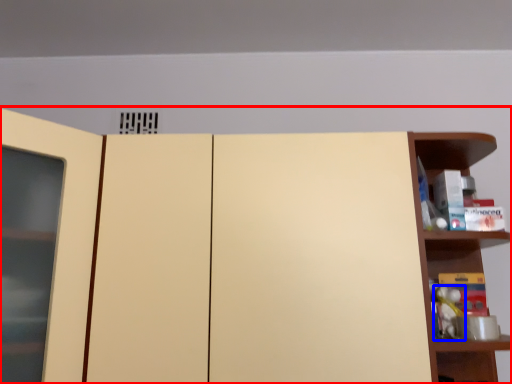
Question: Among these objects, which one is nearest to the camera, cupboard (highlighted by a red box) or toy (highlighted by a blue box)?

Choices:
 (A) cupboard
 (B) toy

Answer: (A)